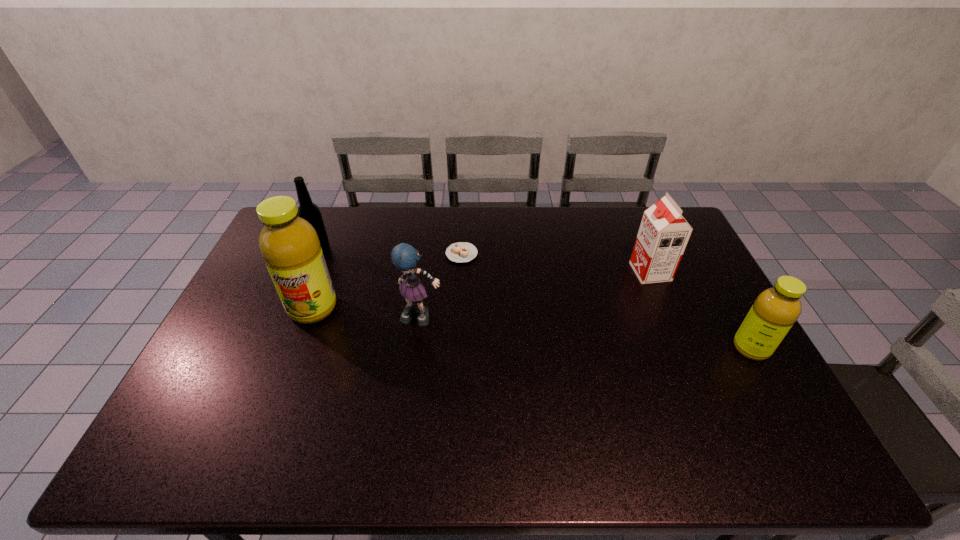
Identify the location of free area in between the left fruit juice and the rag doll. (368, 313).

At what (x,y) coordinates should I click in order to perform the action: click on free spot between the right fruit juice and the rag doll. Please return your answer as a coordinate pair (x, y). The image size is (960, 540). Looking at the image, I should click on (587, 333).

Where is `unoccupied position between the tallest object and the rag doll`? unoccupied position between the tallest object and the rag doll is located at coordinates (368, 313).

Identify the location of the closest object to the shortest object. (405, 257).

Select which object appears as the fifth closest to the farther fruit juice. Please provide its 2D coordinates. Your answer should be formatted as a tuple, i.e. [(x, y)], where the tuple contains the x and y coordinates of a point satisfying the conditions above.

[(775, 310)]